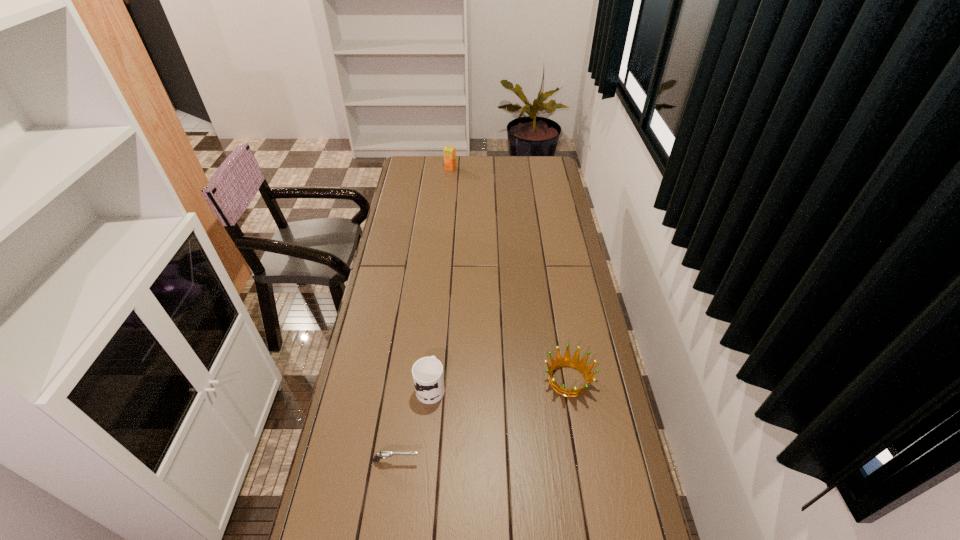
Image resolution: width=960 pixels, height=540 pixels. What are the coordinates of `vacant space in between the mug and the pistol` in the screenshot? It's located at (414, 423).

Identify the location of vacant point located between the crown and the shortest object. (482, 421).

Where is `free spot between the orange juice and the mug`? The image size is (960, 540). free spot between the orange juice and the mug is located at coordinates (441, 278).

Locate an element on the screen. This screenshot has width=960, height=540. free space between the nearest object and the rightmost object is located at coordinates (482, 421).

Locate an element on the screen. The width and height of the screenshot is (960, 540). free space between the farthest object and the mug is located at coordinates (441, 278).

Where is `free space between the rightmost object and the farthest object`? The image size is (960, 540). free space between the rightmost object and the farthest object is located at coordinates (510, 274).

In order to click on vacant space that's between the rightmost object and the mug in this screenshot , I will do `click(499, 383)`.

What are the coordinates of `blank region between the crown and the mug` in the screenshot? It's located at (499, 383).

Identify the location of vacant space that is in between the mug and the rightmost object. The width and height of the screenshot is (960, 540). (499, 383).

Where is `object identified as the second closest to the mug`? The image size is (960, 540). object identified as the second closest to the mug is located at coordinates (567, 361).